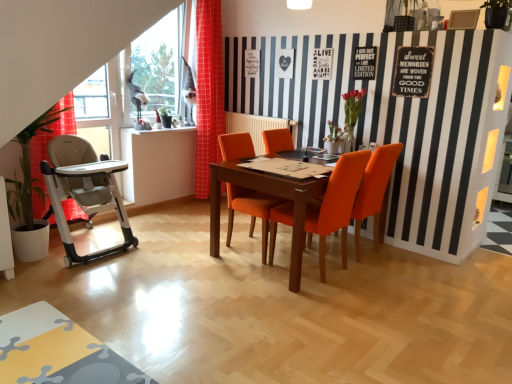
Find the location of a particular element. This screenshot has width=512, height=384. vacant area that lies to the right of orange fabric chair at center, the 3th chair positioned from the left is located at coordinates (409, 257).